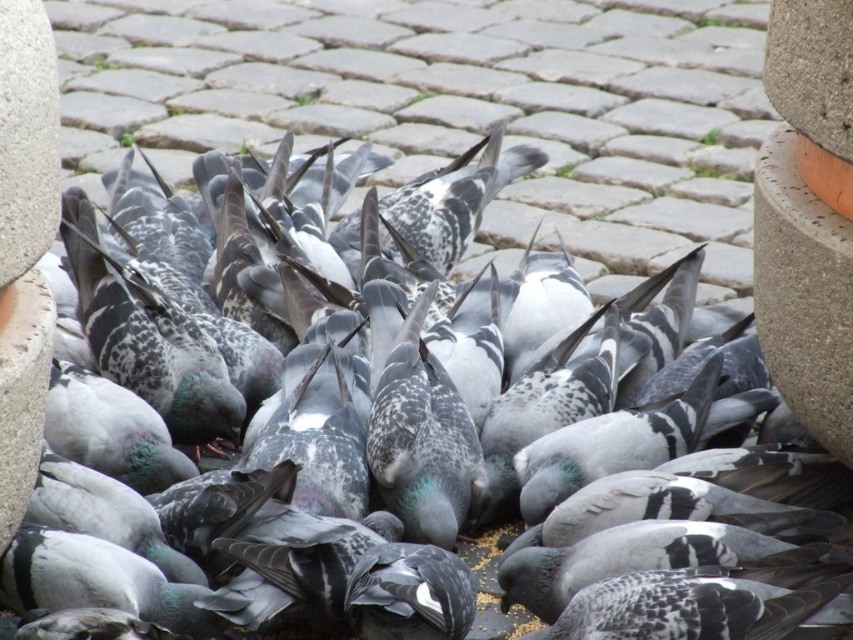
Is point (541, 26) closer to viewer compared to point (816, 202)?

No, it is not.

Is point (497, 83) more distant than point (757, 310)?

That is True.

Locate an element on the screen. gray stone pavement at center is located at coordinates (459, 104).

Find the location of a particular element. gray stone pavement at center is located at coordinates (459, 104).